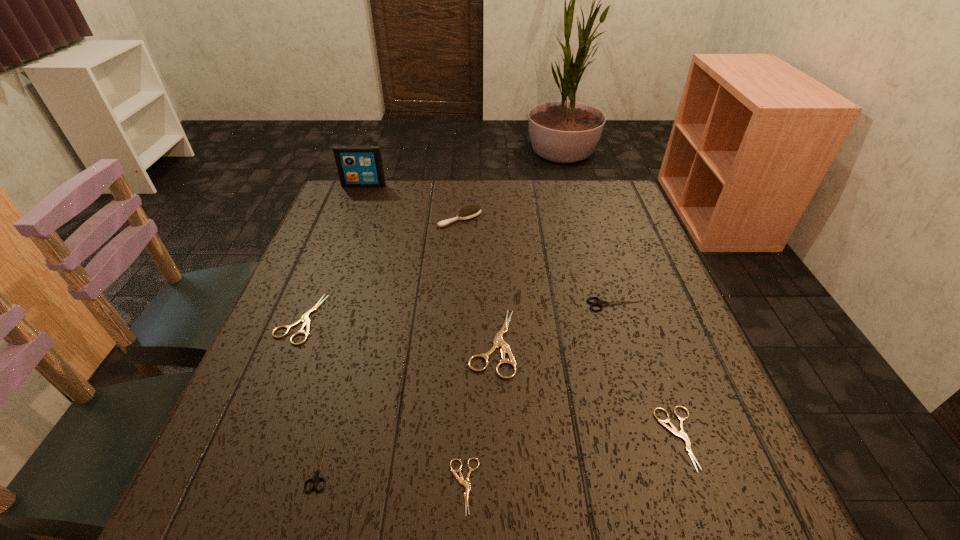
You are a GUI agent. You are given a task and a screenshot of the screen. Output one action in this format:
    pyautogui.click(x=<x>, y=<y>)
    Task: Click on the vacant space situated 0.060m on the right of the nearer black shears
    
    Given the screenshot: What is the action you would take?
    pyautogui.click(x=368, y=464)

This screenshot has width=960, height=540. What are the coordinates of `free space located 0.220m on the back of the shortest shears` in the screenshot? It's located at [468, 353].

At what (x,y) coordinates should I click in order to perform the action: click on iPod that is at the far edge. Please return your answer as a coordinate pair (x, y). Image resolution: width=960 pixels, height=540 pixels. Looking at the image, I should click on click(358, 165).

I want to click on scrubbing brush located in the far edge section of the desktop, so click(471, 211).

Where is `iPod that is at the left edge`? The image size is (960, 540). iPod that is at the left edge is located at coordinates (x=358, y=165).

This screenshot has width=960, height=540. Find the location of `shears at the left edge`. shears at the left edge is located at coordinates [x=305, y=319].

You are a GUI agent. You are given a task and a screenshot of the screen. Output one action in this format:
    pyautogui.click(x=<x>, y=<y>)
    Task: Click on the object at the far left corner
    The height and width of the screenshot is (540, 960).
    Given the screenshot: What is the action you would take?
    pyautogui.click(x=358, y=165)

The height and width of the screenshot is (540, 960). Identify the location of object at the near right corner. (672, 428).

What are the coordinates of `vacant space at the far edge` in the screenshot? It's located at (547, 181).

Find the location of `vacant space at the left edge`. vacant space at the left edge is located at coordinates (286, 302).